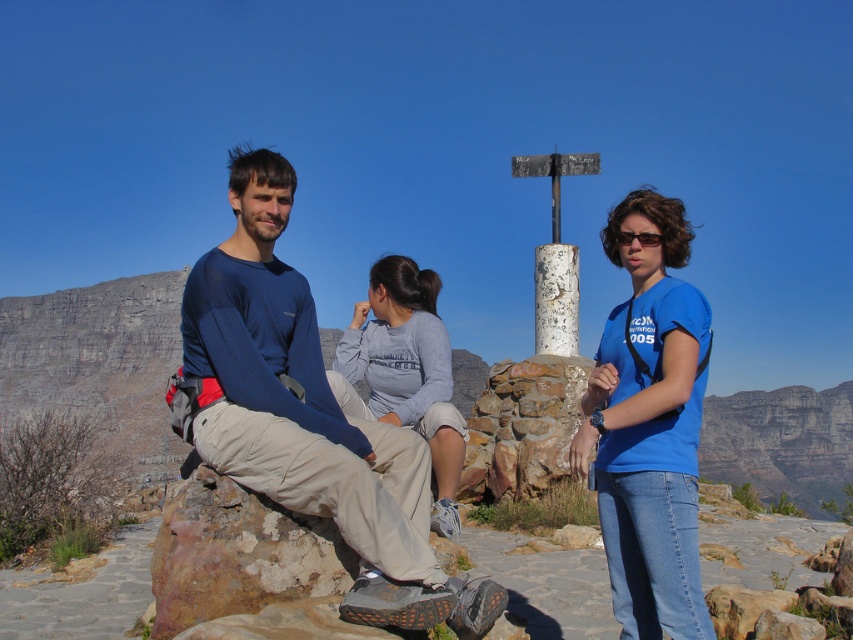
Question: Among these points, which one is nearest to the camera?

Choices:
 (A) (454, 436)
 (B) (230, 204)
 (C) (631, 426)

Answer: (C)

Question: Does blue cotton shirt at center have a greater width compared to gray cotton sweatshirt at center?

Choices:
 (A) yes
 (B) no

Answer: (B)

Question: Among these points, which one is nearest to the camera?

Choices:
 (A) [618, 236]
 (B) [349, 445]

Answer: (B)

Question: Which of the following is the closest to the observer?

Choices:
 (A) blue cotton shirt at center
 (B) gray cotton sweatshirt at center

Answer: (A)

Question: Is blue long-sleeve shirt at center to the right of gray cotton sweatshirt at center from the viewer's perspective?

Choices:
 (A) no
 (B) yes

Answer: (A)

Question: Does blue long-sleeve shirt at center appear on the right side of blue cotton shirt at center?

Choices:
 (A) yes
 (B) no

Answer: (B)